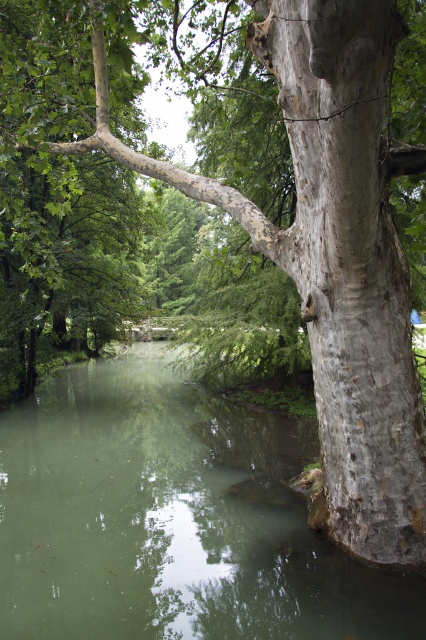
You are standing on the bank of the water and want to take a photo of the smooth gray bark at right and the green smooth water at center. Which object will appear closer to the camera in the photo?

The green smooth water at center will appear closer to the camera in the photo because the smooth gray bark at right is behind it.

You are standing at the edge of the water in the scene. There is a point marked as point [172,518] in the center. What is the color and texture of the water at that point?

The water at point [172,518] is green and smooth.